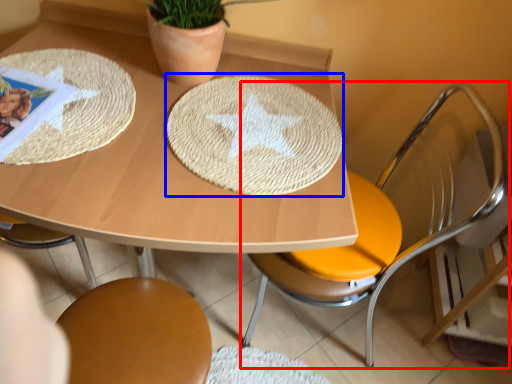
Question: Which object is further to the camera taking this photo, chair (highlighted by a red box) or plate (highlighted by a blue box)?

Choices:
 (A) chair
 (B) plate

Answer: (B)